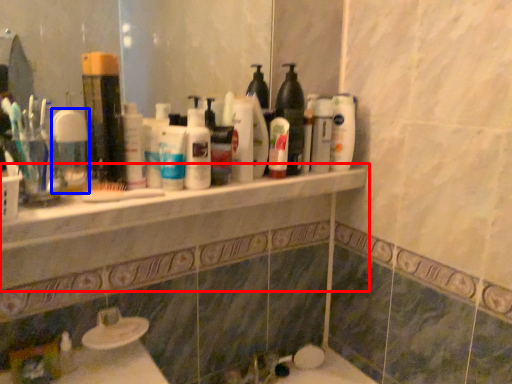
Question: Which object appears farthest to the camera in this image, counter top (highlighted by a red box) or mouthwash (highlighted by a blue box)?

Choices:
 (A) counter top
 (B) mouthwash

Answer: (B)